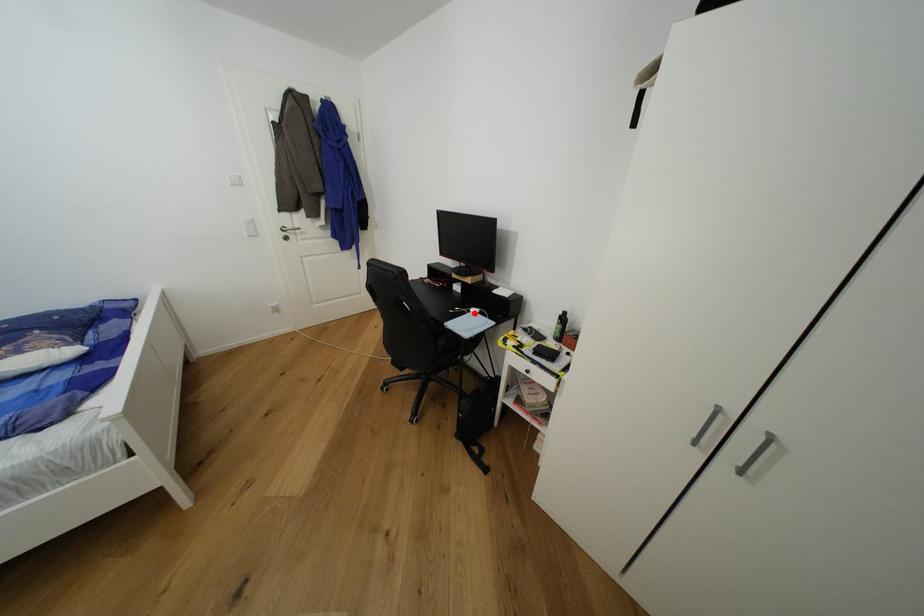
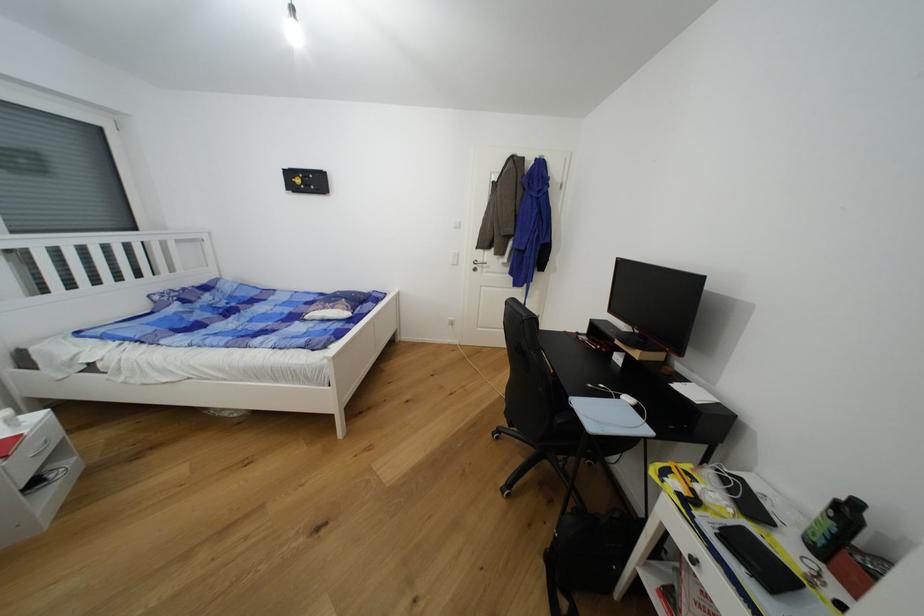
Find the pixel in the second image that matches the highlighted location in the first image.

(623, 399)